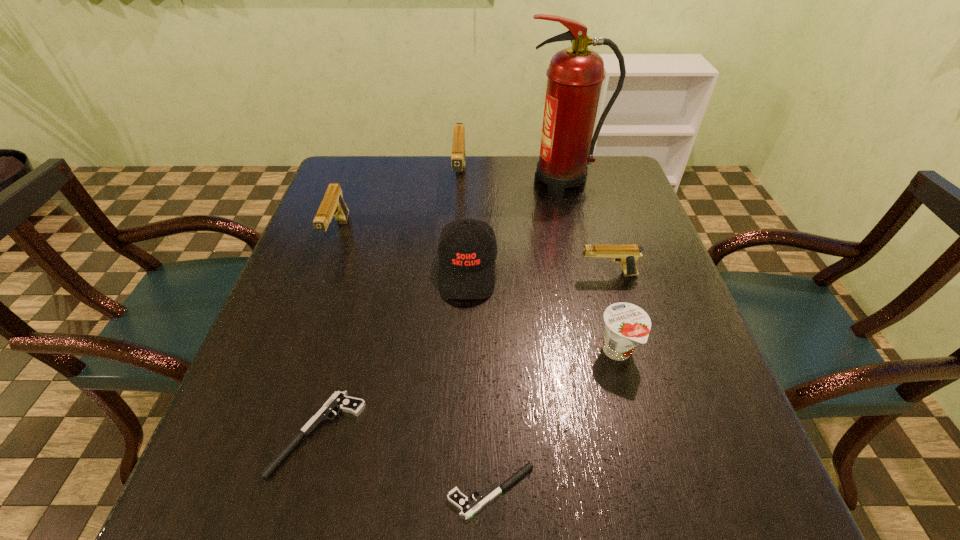
Where is `fire extinguisher at the right edge`? The height and width of the screenshot is (540, 960). fire extinguisher at the right edge is located at coordinates (575, 75).

At what (x,y) coordinates should I click in order to perform the action: click on yogurt located at the right edge. Please return your answer as a coordinate pair (x, y). This screenshot has width=960, height=540. Looking at the image, I should click on (626, 325).

The width and height of the screenshot is (960, 540). Identify the location of pistol situated at the right edge. (627, 254).

Locate an element on the screen. The height and width of the screenshot is (540, 960). object located in the near left corner section of the desktop is located at coordinates (340, 401).

Where is `object that is at the far right corner`? The height and width of the screenshot is (540, 960). object that is at the far right corner is located at coordinates (575, 75).

Find the location of `vacant space at the far edge of the desktop`. vacant space at the far edge of the desktop is located at coordinates (475, 191).

The image size is (960, 540). I want to click on free space at the near edge of the desktop, so click(566, 500).

At what (x,y) coordinates should I click in order to perform the action: click on free region at the left edge of the desktop. Please return your answer as a coordinate pair (x, y). The image size is (960, 540). Looking at the image, I should click on (336, 285).

Locate an element on the screen. Image resolution: width=960 pixels, height=540 pixels. vacant space at the right edge of the desktop is located at coordinates (639, 202).

Find the location of a particular element. The image size is (960, 540). vacant position at the far left corner of the desktop is located at coordinates (340, 178).